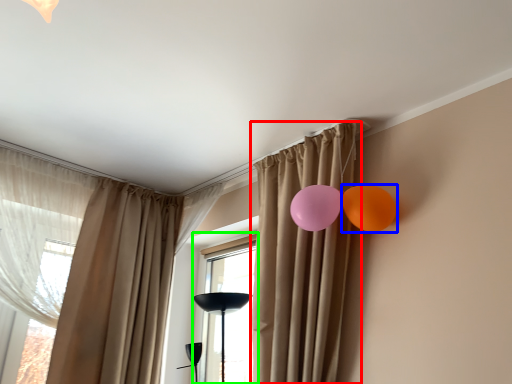
Question: Which object is positioned farthest from curtain (highlighted by a red box)? Select from balloon (highlighted by a blue box) and window (highlighted by a green box).

Choices:
 (A) balloon
 (B) window

Answer: (B)